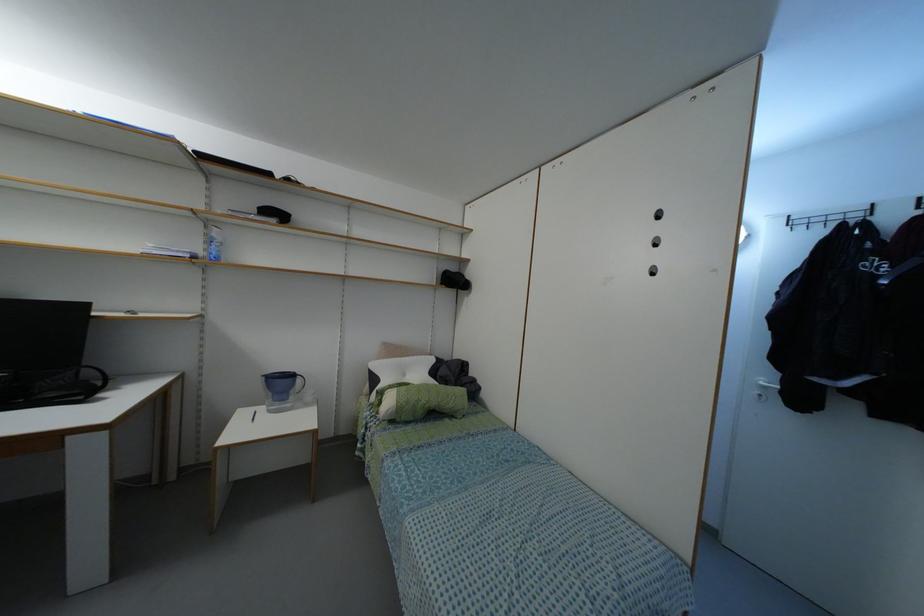
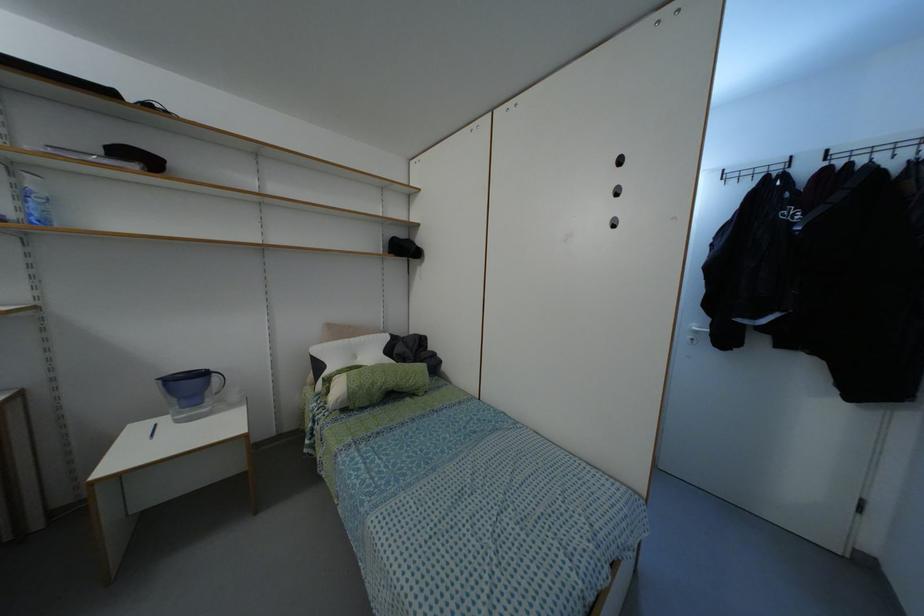
Locate, in the second image, the point that corresponds to (397,359) in the first image.

(345, 339)